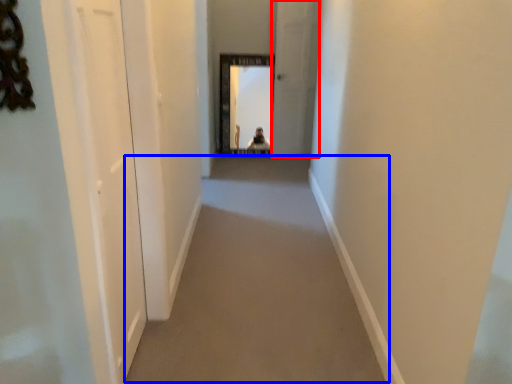
Question: Which of the following is the closest to the observer, screen door (highlighted by a red box) or corridor (highlighted by a blue box)?

Choices:
 (A) screen door
 (B) corridor

Answer: (B)